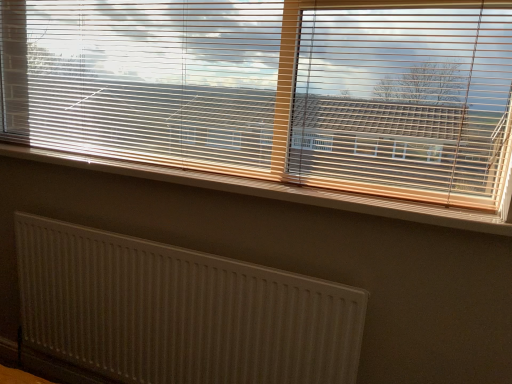
Question: Is white textured radiator at lower left inside or outside of white plastic radiator at lower center?

Choices:
 (A) inside
 (B) outside

Answer: (B)

Question: Looking at the image, does white textured radiator at lower left seem bigger or smaller compared to white plastic radiator at lower center?

Choices:
 (A) small
 (B) big

Answer: (B)

Question: Which object is positioned closest to the wooden blinds at upper center?

Choices:
 (A) white textured radiator at lower left
 (B) white plastic radiator at lower center

Answer: (B)

Question: Considering the real-world distances, which object is farthest from the white textured radiator at lower left?

Choices:
 (A) white plastic radiator at lower center
 (B) wooden blinds at upper center

Answer: (B)